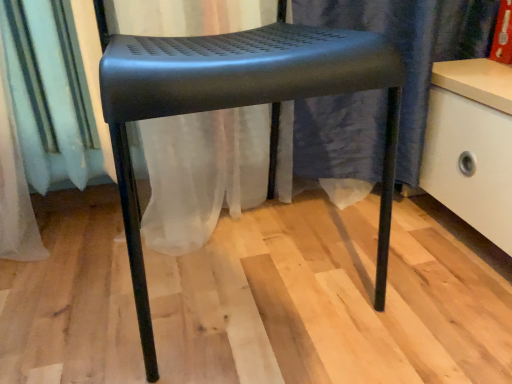
This screenshot has height=384, width=512. Identify the location of vacant space underneath matte black stool at center (from a real-world perspective). (236, 269).